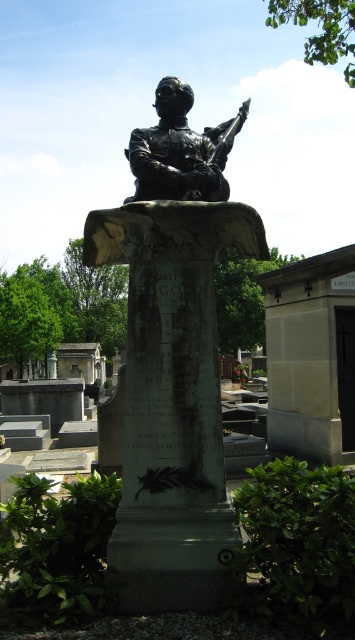
Question: Where is black polished statue at center located in relation to bronze statue at center in the image?

Choices:
 (A) left
 (B) right

Answer: (A)

Question: Which point is closer to the camera?

Choices:
 (A) bronze statue at center
 (B) black polished statue at center

Answer: (B)

Question: Can you confirm if black polished statue at center is wider than bronze statue at center?

Choices:
 (A) yes
 (B) no

Answer: (A)

Question: Which object is farther from the camera taking this photo?

Choices:
 (A) black polished statue at center
 (B) bronze statue at center

Answer: (B)

Question: Can you confirm if black polished statue at center is positioned above bronze statue at center?

Choices:
 (A) yes
 (B) no

Answer: (B)